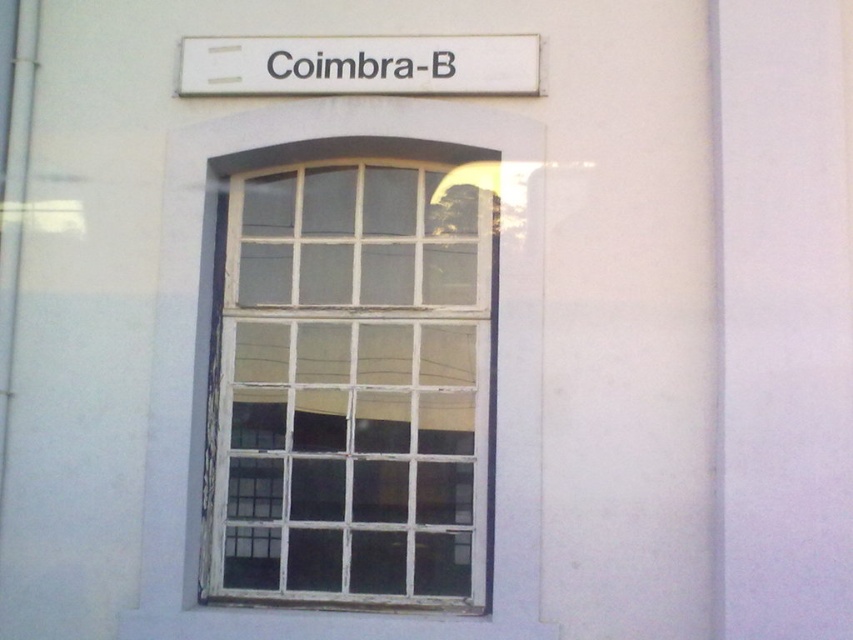
Question: Is white wooden window at center wider than white plastic sign at upper center?

Choices:
 (A) no
 (B) yes

Answer: (A)

Question: Can you confirm if white wooden window at center is positioned to the left of white plastic sign at upper center?

Choices:
 (A) yes
 (B) no

Answer: (A)

Question: Can you confirm if white wooden window at center is positioned to the left of white plastic sign at upper center?

Choices:
 (A) no
 (B) yes

Answer: (B)